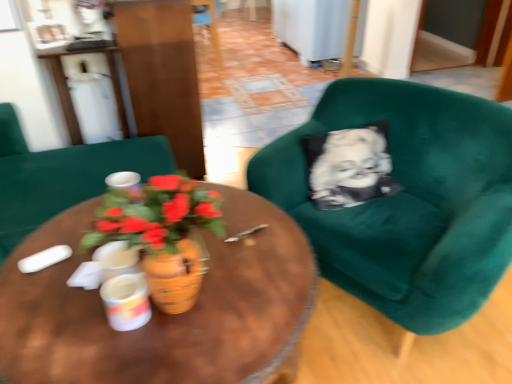
Find the location of `white glossy table at upper left`. white glossy table at upper left is located at coordinates (70, 93).

This screenshot has width=512, height=384. What do you see at coordinates (163, 235) in the screenshot?
I see `terracotta pot at center` at bounding box center [163, 235].

This screenshot has width=512, height=384. I want to click on terracotta pot at center, so click(x=163, y=235).

What is the approximate width of white glossy cup at center, which is the 2th coffee cup from front to back?

white glossy cup at center, which is the 2th coffee cup from front to back, is 3.67 inches in width.

Identify the location of white glossy cup at center, arranged as the second coffee cup when ordered from the bottom. (126, 184).

Describe the element at coordinates (408, 201) in the screenshot. The image size is (512, 384). I see `velvet green armchair at right, arranged as the 3th chair when viewed from the left` at that location.

At what (x,y) coordinates should I click in order to perform the action: click on matte green armchair at center, the second chair viewed from the back. Please return your answer as a coordinate pair (x, y). The image size is (512, 384). Looking at the image, I should click on [63, 175].

How much space does white glossy coffee cup at center, placed as the first coffee cup when sorted from front to back, occupy vertically?

The height of white glossy coffee cup at center, placed as the first coffee cup when sorted from front to back, is 3.98 inches.

I want to click on white glossy coffee cup at center, which appears as the second coffee cup when viewed from the left, so click(126, 301).

This screenshot has width=512, height=384. I want to click on woodenobject at center, so click(163, 313).

Find the location of a particular element. The height and width of the screenshot is (384, 512). white glossy table at upper left is located at coordinates (70, 93).

Looking at this image, can you confirm if terracotta pot at center is positioned to the right of white glossy cup at center, marked as the 1th coffee cup in a top-to-bottom arrangement?

Correct, you'll find terracotta pot at center to the right of white glossy cup at center, marked as the 1th coffee cup in a top-to-bottom arrangement.

Does terracotta pot at center turn towards white glossy cup at center, arranged as the second coffee cup when ordered from the bottom?

No, terracotta pot at center does not turn towards white glossy cup at center, arranged as the second coffee cup when ordered from the bottom.

Between terracotta pot at center and white glossy cup at center, marked as the 1th coffee cup in a top-to-bottom arrangement, which one has more height?

Standing taller between the two is terracotta pot at center.

Between terracotta pot at center and white glossy cup at center, marked as the 1th coffee cup in a top-to-bottom arrangement, which one has smaller size?

With smaller size is white glossy cup at center, marked as the 1th coffee cup in a top-to-bottom arrangement.

Considering the sizes of objects woodenobject at center and velvet green armchair at right, the 1th chair when ordered from right to left, in the image provided, who is shorter, woodenobject at center or velvet green armchair at right, the 1th chair when ordered from right to left,?

Standing shorter between the two is woodenobject at center.

From the image's perspective, is woodenobject at center below velvet green armchair at right, arranged as the 3th chair when viewed from the left?

Indeed, from the image's perspective, woodenobject at center is shown beneath velvet green armchair at right, arranged as the 3th chair when viewed from the left.

Considering the sizes of woodenobject at center and velvet green armchair at right, which is the 1th chair from front to back, in the image, is woodenobject at center bigger or smaller than velvet green armchair at right, which is the 1th chair from front to back,?

Considering their sizes, woodenobject at center takes up less space than velvet green armchair at right, which is the 1th chair from front to back.

What's the angular difference between woodenobject at center and velvet green armchair at right, arranged as the 3th chair when viewed from the left,'s facing directions?

The facing directions of woodenobject at center and velvet green armchair at right, arranged as the 3th chair when viewed from the left, are 150 degrees apart.

Who is taller, terracotta pot at center or velvet green armchair at right, which is the 1th chair from front to back?

With more height is velvet green armchair at right, which is the 1th chair from front to back.

Is there a large distance between terracotta pot at center and velvet green armchair at right, the 3th chair in the back-to-front sequence?

terracotta pot at center is near velvet green armchair at right, the 3th chair in the back-to-front sequence, not far away.

From a real-world perspective, who is located lower, terracotta pot at center or velvet green armchair at right, the 3th chair in the back-to-front sequence?

Result: velvet green armchair at right, the 3th chair in the back-to-front sequence, is physically lower.

Is terracotta pot at center in front of or behind velvet green armchair at right, the 1th chair when ordered from right to left, in the image?

terracotta pot at center is positioned closer to the viewer than velvet green armchair at right, the 1th chair when ordered from right to left.

How many degrees apart are the facing directions of matte green armchair at center, positioned as the 1th chair in left-to-right order, and white glossy coffee cup at center, which is the first coffee cup in bottom-to-top order?

There is a 8.63-degree angle between the facing directions of matte green armchair at center, positioned as the 1th chair in left-to-right order, and white glossy coffee cup at center, which is the first coffee cup in bottom-to-top order.

Does matte green armchair at center, acting as the 2th chair starting from the top, contain white glossy coffee cup at center, which appears as the second coffee cup when viewed from the left?

Definitely not — white glossy coffee cup at center, which appears as the second coffee cup when viewed from the left, is not inside matte green armchair at center, acting as the 2th chair starting from the top.

Is matte green armchair at center, positioned as the 1th chair in left-to-right order, bigger than white glossy coffee cup at center, marked as the 2th coffee cup in a top-to-bottom arrangement?

Indeed, matte green armchair at center, positioned as the 1th chair in left-to-right order, has a larger size compared to white glossy coffee cup at center, marked as the 2th coffee cup in a top-to-bottom arrangement.

Considering the positions of objects matte green armchair at center, the 2th chair positioned from the bottom, and white glossy coffee cup at center, placed as the first coffee cup when sorted from front to back, in the image provided, who is in front, matte green armchair at center, the 2th chair positioned from the bottom, or white glossy coffee cup at center, placed as the first coffee cup when sorted from front to back,?

white glossy coffee cup at center, placed as the first coffee cup when sorted from front to back, is in front.

Find the location of `houseplant below the white glossy cup at center, marked as the 1th coffee cup in a top-to-bottom arrangement (from the image's perspective)`. houseplant below the white glossy cup at center, marked as the 1th coffee cup in a top-to-bottom arrangement (from the image's perspective) is located at coordinates (163, 235).

From a real-world perspective, is white glossy cup at center, which is the first coffee cup from left to right, positioned under terracotta pot at center based on gravity?

Yes.

Which point is more distant from viewer, (114, 175) or (126, 192)?

The point (114, 175) is behind.

Consider the image. Do you think terracotta pot at center is within wooden chair at center, the second chair positioned from the left, or outside of it?

The correct answer is: outside.

Between terracotta pot at center and wooden chair at center, marked as the 1th chair in a top-to-bottom arrangement, which one is positioned behind?

wooden chair at center, marked as the 1th chair in a top-to-bottom arrangement, is behind.

Is terracotta pot at center to the right of wooden chair at center, which is the second chair in right-to-left order, from the viewer's perspective?

Indeed, terracotta pot at center is positioned on the right side of wooden chair at center, which is the second chair in right-to-left order.

From a real-world perspective, is terracotta pot at center over wooden chair at center, which ranks as the first chair in back-to-front order?

Yes, from a real-world perspective, terracotta pot at center is on top of wooden chair at center, which ranks as the first chair in back-to-front order.

Between white glossy cup at center, which is counted as the 2th coffee cup, starting from the right, and woodenobject at center, which one has larger width?

With larger width is woodenobject at center.

Consider the image. Which of these two, white glossy cup at center, which is counted as the 2th coffee cup, starting from the right, or woodenobject at center, stands taller?

woodenobject at center is taller.

Is woodenobject at center surrounded by white glossy cup at center, which is counted as the 2th coffee cup, starting from the right?

No, woodenobject at center is located outside of white glossy cup at center, which is counted as the 2th coffee cup, starting from the right.

Visually, is white glossy cup at center, arranged as the second coffee cup when ordered from the bottom, positioned to the left or to the right of woodenobject at center?

white glossy cup at center, arranged as the second coffee cup when ordered from the bottom, is positioned on woodenobject at center's left side.

Identify the location of houseplant below the white glossy cup at center, marked as the 1th coffee cup in a top-to-bottom arrangement (from the image's perspective). Image resolution: width=512 pixels, height=384 pixels. (163, 235).

Find the location of a particular element. chair that is the 2nd one above the woodenobject at center (from a real-world perspective) is located at coordinates (408, 201).

Which object lies nearer to the anchor point matte green armchair at center, which is the 2th chair from front to back, white glossy cup at center, which is counted as the 2th coffee cup, starting from the right, or velvet green armchair at right, the third chair viewed from the top?

white glossy cup at center, which is counted as the 2th coffee cup, starting from the right, is positioned closer to the anchor matte green armchair at center, which is the 2th chair from front to back.

Consider the image. Based on their spatial positions, is white glossy coffee cup at center, placed as the 1th coffee cup when sorted from right to left, or terracotta pot at center closer to white glossy cup at center, arranged as the second coffee cup when ordered from the bottom?

Based on the image, terracotta pot at center appears to be nearer to white glossy cup at center, arranged as the second coffee cup when ordered from the bottom.

From the image, which object appears to be farther from woodenobject at center, white glossy table at upper left or white glossy coffee cup at center, which appears as the second coffee cup when viewed from the left?

Based on the image, white glossy table at upper left appears to be further to woodenobject at center.

From the image, which object appears to be farther from woodenobject at center, velvet green armchair at right, the 1th chair when ordered from right to left, or matte green armchair at center, acting as the 2th chair starting from the top?

matte green armchair at center, acting as the 2th chair starting from the top, is positioned further to the anchor woodenobject at center.

Which object lies further to the anchor point matte green armchair at center, positioned as the 1th chair in left-to-right order, white glossy cup at center, which is the first coffee cup from left to right, or woodenobject at center?

The object further to matte green armchair at center, positioned as the 1th chair in left-to-right order, is woodenobject at center.

Which object lies nearer to the anchor point white glossy cup at center, which is the first coffee cup from left to right, terracotta pot at center or white glossy table at upper left?

terracotta pot at center is closer to white glossy cup at center, which is the first coffee cup from left to right.

Based on their spatial positions, is white glossy table at upper left or white glossy cup at center, arranged as the 1th coffee cup when viewed from the back, closer to velvet green armchair at right, which is the 1th chair from front to back?

white glossy cup at center, arranged as the 1th coffee cup when viewed from the back.

From the image, which object appears to be farther from wooden chair at center, which ranks as the third chair in front-to-back order, matte green armchair at center, the second chair viewed from the back, or white glossy cup at center, marked as the 1th coffee cup in a top-to-bottom arrangement?

white glossy cup at center, marked as the 1th coffee cup in a top-to-bottom arrangement, lies further to wooden chair at center, which ranks as the third chair in front-to-back order, than the other object.

Locate an element on the screen. This screenshot has width=512, height=384. houseplant between matte green armchair at center, which ranks as the third chair in right-to-left order, and velvet green armchair at right, which is the 1th chair from bottom to top, from left to right is located at coordinates (163, 235).

Identify the location of houseplant between white glossy coffee cup at center, marked as the 2th coffee cup in a top-to-bottom arrangement, and velvet green armchair at right, the third chair viewed from the top, from left to right. The width and height of the screenshot is (512, 384). (163, 235).

Where is `coffee cup between white glossy cup at center, marked as the 1th coffee cup in a top-to-bottom arrangement, and velvet green armchair at right, arranged as the 3th chair when viewed from the left, in the horizontal direction`? The height and width of the screenshot is (384, 512). coffee cup between white glossy cup at center, marked as the 1th coffee cup in a top-to-bottom arrangement, and velvet green armchair at right, arranged as the 3th chair when viewed from the left, in the horizontal direction is located at coordinates (126, 301).

Locate an element on the screen. Image resolution: width=512 pixels, height=384 pixels. coffee cup between woodenobject at center and white glossy cup at center, marked as the 1th coffee cup in a top-to-bottom arrangement, along the z-axis is located at coordinates (126, 301).